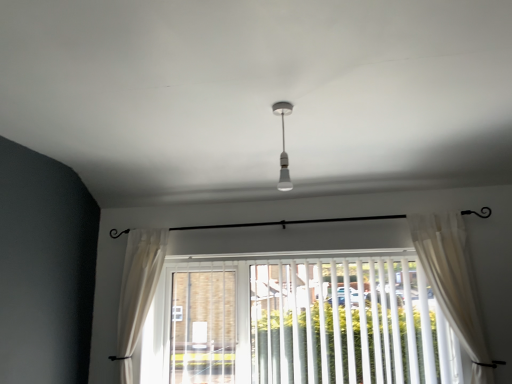
You are a GUI agent. You are given a task and a screenshot of the screen. Output one action in this format:
    pyautogui.click(x=<x>, y=<y>)
    Task: Click on the white sheer curtain at lower center, the first curtain when ordered from left to right
    
    Given the screenshot: What is the action you would take?
    pyautogui.click(x=137, y=291)

Identify the location of white plastic blinds at center. (338, 320).

The width and height of the screenshot is (512, 384). Describe the element at coordinates (338, 320) in the screenshot. I see `white plastic blinds at center` at that location.

The image size is (512, 384). What do you see at coordinates (453, 283) in the screenshot? I see `white sheer curtain at right, the second curtain when ordered from back to front` at bounding box center [453, 283].

The height and width of the screenshot is (384, 512). Find the location of `white glossy bulb at center`. white glossy bulb at center is located at coordinates (283, 147).

Identify the location of white sheer curtain at lower center, arranged as the 2th curtain when viewed from the front. (137, 291).

From the image's perspective, is white glossy bulb at center below white plastic blinds at center?

Actually, white glossy bulb at center appears above white plastic blinds at center in the image.

In terms of width, does white glossy bulb at center look wider or thinner when compared to white plastic blinds at center?

In the image, white glossy bulb at center appears to be more narrow than white plastic blinds at center.

Can you confirm if white glossy bulb at center is bigger than white plastic blinds at center?

No.

From the image's perspective, which one is positioned lower, white sheer curtain at right, the second curtain when ordered from back to front, or white sheer curtain at lower center, the first curtain when ordered from left to right?

white sheer curtain at lower center, the first curtain when ordered from left to right, appears lower in the image.

Which is closer, (x=468, y=280) or (x=149, y=290)?

Point (x=468, y=280) is positioned closer to the camera compared to point (x=149, y=290).

Is white sheer curtain at right, the second curtain when ordered from back to front, turned away from white sheer curtain at lower center, the first curtain when ordered from left to right?

No, white sheer curtain at right, the second curtain when ordered from back to front, is not facing the opposite direction of white sheer curtain at lower center, the first curtain when ordered from left to right.

Is there a large distance between white sheer curtain at right, which appears as the 1th curtain when viewed from the front, and white sheer curtain at lower center, the 2th curtain in the right-to-left sequence?

Yes, white sheer curtain at right, which appears as the 1th curtain when viewed from the front, and white sheer curtain at lower center, the 2th curtain in the right-to-left sequence, are located far from each other.

Looking at this image, can you tell me how much white sheer curtain at lower center, the first curtain when ordered from left to right, and white plastic blinds at center differ in facing direction?

white sheer curtain at lower center, the first curtain when ordered from left to right, and white plastic blinds at center are facing 0.631 degrees away from each other.

Which of these two, white sheer curtain at lower center, which ranks as the first curtain in back-to-front order, or white plastic blinds at center, stands taller?

white sheer curtain at lower center, which ranks as the first curtain in back-to-front order.

Is point (137, 269) positioned in front of point (403, 344)?

That is False.

Consider the image. Is white sheer curtain at lower center, which ranks as the first curtain in back-to-front order, next to white plastic blinds at center?

There is a gap between white sheer curtain at lower center, which ranks as the first curtain in back-to-front order, and white plastic blinds at center.

Is white sheer curtain at right, the second curtain when ordered from back to front, surrounded by white sheer curtain at lower center, the first curtain when ordered from left to right?

That's incorrect, white sheer curtain at right, the second curtain when ordered from back to front, is not inside white sheer curtain at lower center, the first curtain when ordered from left to right.

From the image's perspective, between white sheer curtain at lower center, which ranks as the first curtain in back-to-front order, and white sheer curtain at right, which appears as the 1th curtain when viewed from the front, who is located below?

white sheer curtain at lower center, which ranks as the first curtain in back-to-front order.

Considering the positions of objects white sheer curtain at lower center, arranged as the 2th curtain when viewed from the front, and white sheer curtain at right, which appears as the 1th curtain when viewed from the front, in the image provided, who is behind, white sheer curtain at lower center, arranged as the 2th curtain when viewed from the front, or white sheer curtain at right, which appears as the 1th curtain when viewed from the front,?

Positioned behind is white sheer curtain at lower center, arranged as the 2th curtain when viewed from the front.

Is white plastic blinds at center inside the boundaries of white sheer curtain at right, which is the 1th curtain in right-to-left order, or outside?

white plastic blinds at center lies outside white sheer curtain at right, which is the 1th curtain in right-to-left order.

From the image's perspective, relative to white sheer curtain at right, which ranks as the second curtain in left-to-right order, is white plastic blinds at center above or below?

white plastic blinds at center is situated lower than white sheer curtain at right, which ranks as the second curtain in left-to-right order, in the image.

Between white plastic blinds at center and white sheer curtain at right, which appears as the 1th curtain when viewed from the front, which one is positioned in front?

white sheer curtain at right, which appears as the 1th curtain when viewed from the front, is more forward.

Is white plastic blinds at center to the left or to the right of white sheer curtain at right, which is the 1th curtain in right-to-left order, in the image?

white plastic blinds at center is positioned on white sheer curtain at right, which is the 1th curtain in right-to-left order,'s left side.

How different are the orientations of white glossy bulb at center and white sheer curtain at right, the second curtain when ordered from back to front, in degrees?

90.4 degrees.

Are white glossy bulb at center and white sheer curtain at right, which is the 1th curtain in right-to-left order, far apart?

No, white glossy bulb at center is in close proximity to white sheer curtain at right, which is the 1th curtain in right-to-left order.

Is white glossy bulb at center turned away from white sheer curtain at right, which ranks as the second curtain in left-to-right order?

No, white sheer curtain at right, which ranks as the second curtain in left-to-right order, is not at the back of white glossy bulb at center.

From the image's perspective, would you say white sheer curtain at right, which appears as the 1th curtain when viewed from the front, is shown under white plastic blinds at center?

Actually, white sheer curtain at right, which appears as the 1th curtain when viewed from the front, appears above white plastic blinds at center in the image.

From a real-world perspective, is white sheer curtain at right, which ranks as the second curtain in left-to-right order, below white plastic blinds at center?

No.

Relative to white plastic blinds at center, is white sheer curtain at right, the second curtain when ordered from back to front, in front or behind?

white sheer curtain at right, the second curtain when ordered from back to front, is positioned closer to the viewer than white plastic blinds at center.

Image resolution: width=512 pixels, height=384 pixels. In order to click on light fixture above the white plastic blinds at center (from a real-world perspective) in this screenshot , I will do `click(283, 147)`.

This screenshot has width=512, height=384. I want to click on curtain that appears below the white sheer curtain at right, which ranks as the second curtain in left-to-right order (from the image's perspective), so click(137, 291).

Considering their positions, is white sheer curtain at right, the second curtain when ordered from back to front, positioned closer to white sheer curtain at lower center, arranged as the 2th curtain when viewed from the front, than white plastic blinds at center?

white plastic blinds at center lies closer to white sheer curtain at lower center, arranged as the 2th curtain when viewed from the front, than the other object.

From the image, which object appears to be farther from white glossy bulb at center, white sheer curtain at right, which is the 1th curtain in right-to-left order, or white sheer curtain at lower center, which ranks as the first curtain in back-to-front order?

white sheer curtain at lower center, which ranks as the first curtain in back-to-front order, is further to white glossy bulb at center.

When comparing their distances from white sheer curtain at right, which appears as the 1th curtain when viewed from the front, does white glossy bulb at center or white plastic blinds at center seem further?

white glossy bulb at center lies further to white sheer curtain at right, which appears as the 1th curtain when viewed from the front, than the other object.

Which object lies nearer to the anchor point white glossy bulb at center, white sheer curtain at lower center, the first curtain when ordered from left to right, or white sheer curtain at right, which is the 1th curtain in right-to-left order?

white sheer curtain at right, which is the 1th curtain in right-to-left order, is closer to white glossy bulb at center.

When comparing their distances from white glossy bulb at center, does white plastic blinds at center or white sheer curtain at right, the second curtain when ordered from back to front, seem closer?

Based on the image, white plastic blinds at center appears to be nearer to white glossy bulb at center.

From the image, which object appears to be nearer to white plastic blinds at center, white glossy bulb at center or white sheer curtain at right, which appears as the 1th curtain when viewed from the front?

The object closer to white plastic blinds at center is white sheer curtain at right, which appears as the 1th curtain when viewed from the front.

Looking at the image, which one is located further to white glossy bulb at center, white plastic blinds at center or white sheer curtain at lower center, which ranks as the first curtain in back-to-front order?

Based on the image, white sheer curtain at lower center, which ranks as the first curtain in back-to-front order, appears to be further to white glossy bulb at center.

When comparing their distances from white sheer curtain at lower center, the first curtain when ordered from left to right, does white glossy bulb at center or white plastic blinds at center seem further?

white glossy bulb at center.

Where is `light fixture between white sheer curtain at lower center, arranged as the 2th curtain when viewed from the front, and white sheer curtain at right, which is the 1th curtain in right-to-left order`? The height and width of the screenshot is (384, 512). light fixture between white sheer curtain at lower center, arranged as the 2th curtain when viewed from the front, and white sheer curtain at right, which is the 1th curtain in right-to-left order is located at coordinates (283, 147).

The height and width of the screenshot is (384, 512). I want to click on window blind between white glossy bulb at center and white sheer curtain at right, the second curtain when ordered from back to front, so click(x=338, y=320).

Locate an element on the screen. Image resolution: width=512 pixels, height=384 pixels. window blind between white sheer curtain at lower center, arranged as the 2th curtain when viewed from the front, and white sheer curtain at right, the second curtain when ordered from back to front is located at coordinates (338, 320).